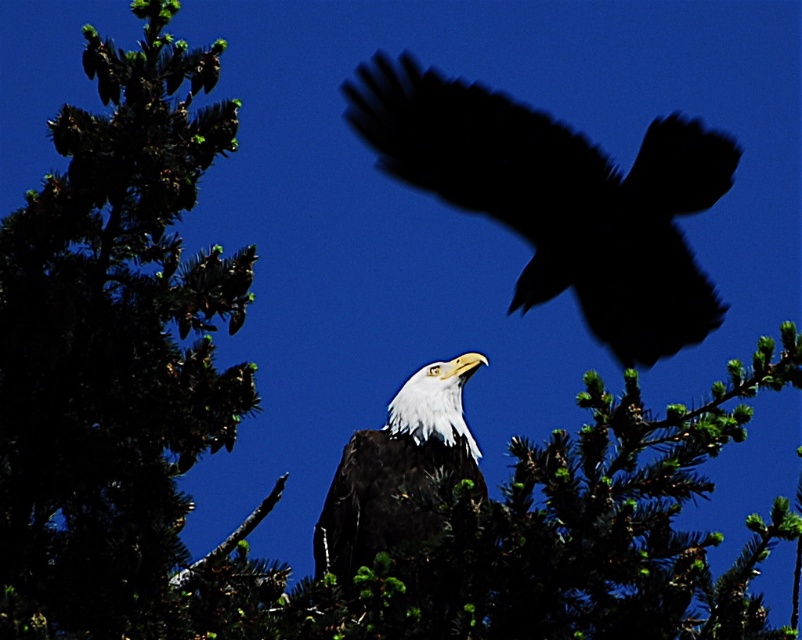
Question: Which object is positioned farthest from the white glossy eagle at center?

Choices:
 (A) white feathered bald eagle at center
 (B) green leafy tree at upper left

Answer: (A)

Question: Among these points, which one is farthest from the camera?

Choices:
 (A) (379, 451)
 (B) (63, 624)

Answer: (A)

Question: Is green leafy tree at upper left further to camera compared to white glossy eagle at center?

Choices:
 (A) no
 (B) yes

Answer: (A)

Question: Where is green leafy tree at upper left located in relation to white feathered bald eagle at center in the image?

Choices:
 (A) above
 (B) below

Answer: (B)

Question: Can you confirm if green leafy tree at upper left is bigger than white feathered bald eagle at center?

Choices:
 (A) yes
 (B) no

Answer: (B)

Question: Considering the real-world distances, which object is closest to the green leafy tree at upper left?

Choices:
 (A) white glossy eagle at center
 (B) white feathered bald eagle at center

Answer: (A)